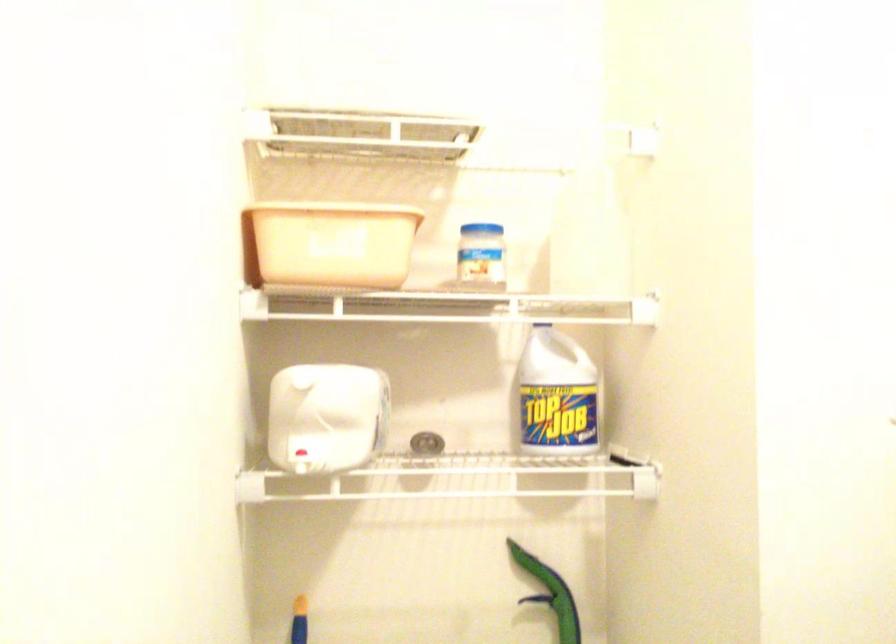
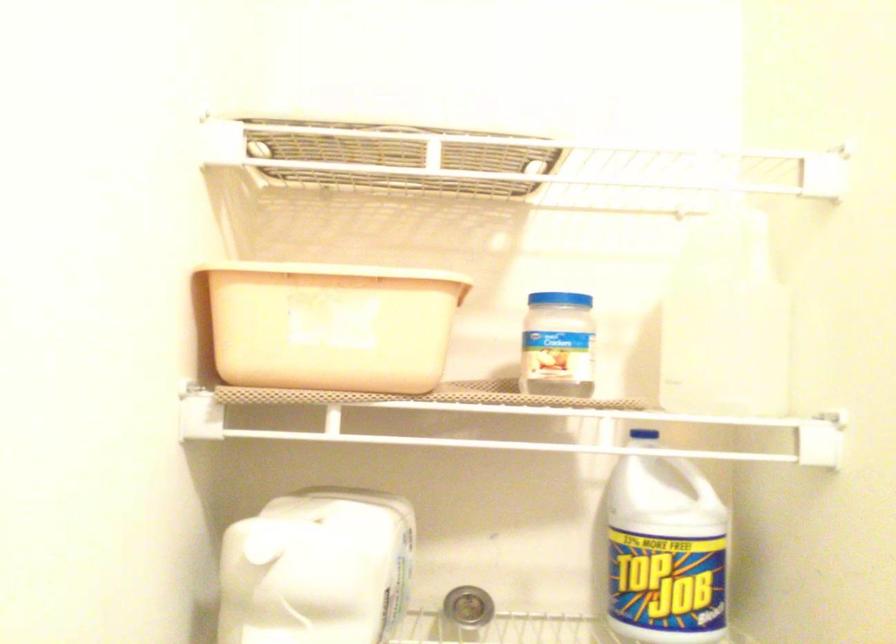
In the second image, find the point that corresponds to [479,227] in the first image.

(558, 299)